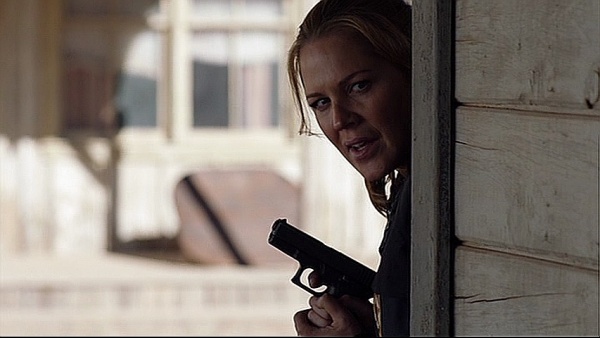
Locate an element on the screen. wooden wall is located at coordinates (440, 22), (441, 313).